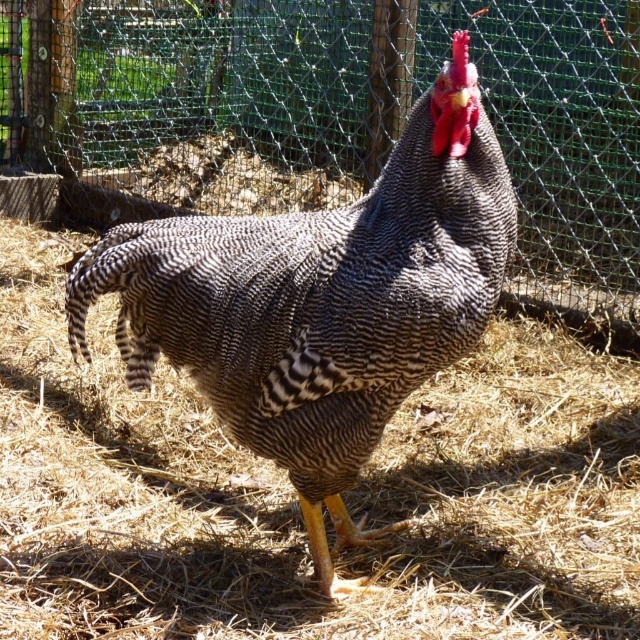
Is point (586, 273) behind point (435, 305)?

Yes, it is.

Which is behind, point (145, 193) or point (378, 419)?

The point (145, 193) is more distant.

Locate an element on the screen. The width and height of the screenshot is (640, 640). green mesh fence at center is located at coordinates (340, 115).